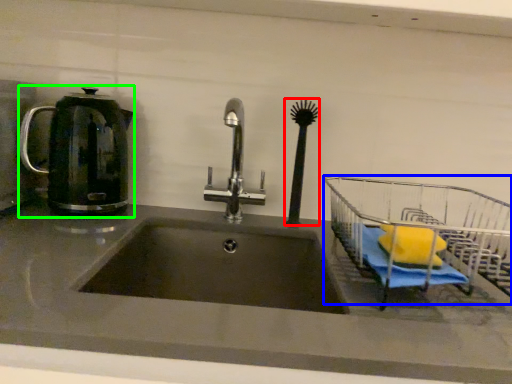
Question: Based on their relative distances, which object is nearer to brush (highlighted by a red box)? Choose from cart (highlighted by a blue box) and kettle (highlighted by a green box).

Choices:
 (A) cart
 (B) kettle

Answer: (A)